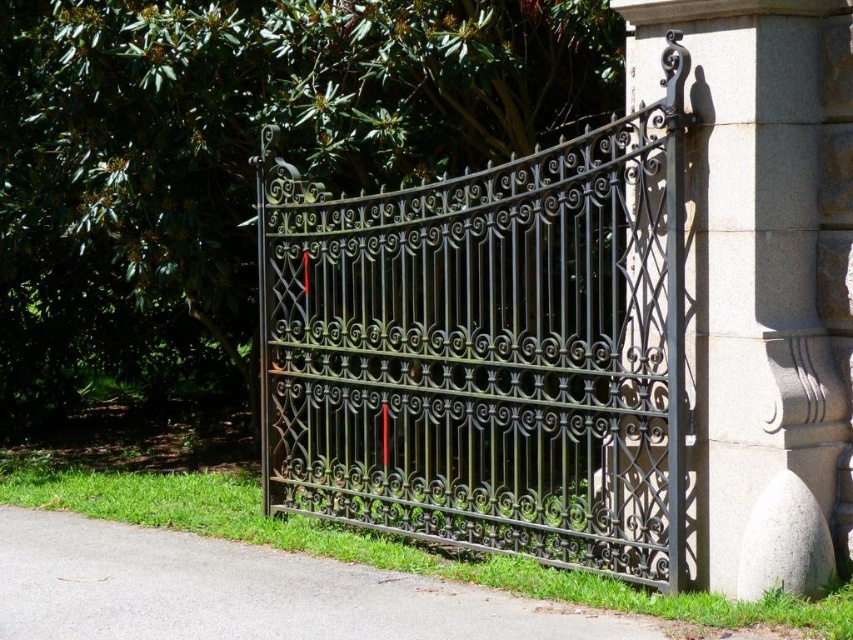
Question: Can you confirm if black wrought iron gate at center is bigger than gray stone pillar at center right?

Choices:
 (A) yes
 (B) no

Answer: (A)

Question: Which object appears closest to the camera in this image?

Choices:
 (A) gray stone pillar at center right
 (B) black wrought iron gate at center

Answer: (A)

Question: Where is black wrought iron gate at center located in relation to gray stone pillar at center right in the image?

Choices:
 (A) above
 (B) below

Answer: (B)

Question: Does black wrought iron gate at center appear over gray stone pillar at center right?

Choices:
 (A) yes
 (B) no

Answer: (B)